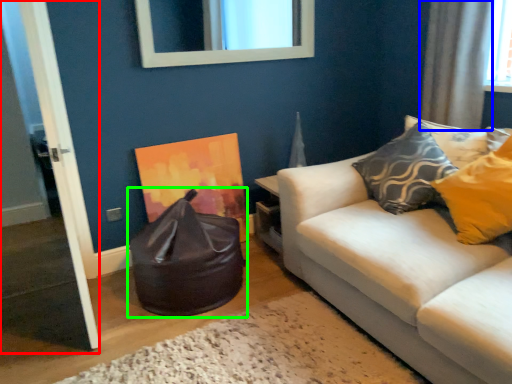
Question: Estimate the real-world distances between objects in this image. Which object is farther from door (highlighted by a red box), curtain (highlighted by a blue box) or bean bag chair (highlighted by a green box)?

Choices:
 (A) curtain
 (B) bean bag chair

Answer: (A)